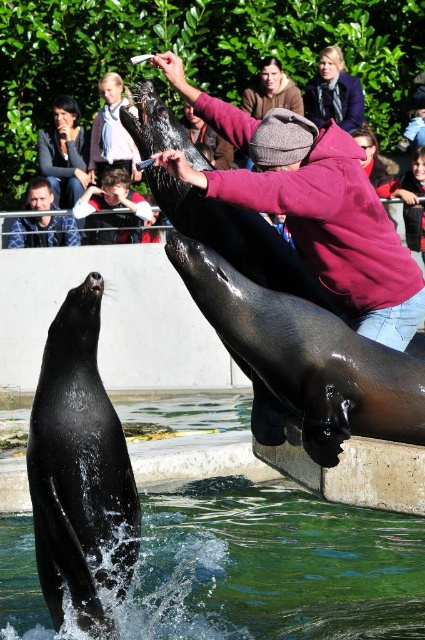
Does shiny black seal at center appear on the right side of light blue scarf at upper center?

Indeed, shiny black seal at center is positioned on the right side of light blue scarf at upper center.

Based on the photo, does shiny black seal at center appear over light blue scarf at upper center?

No.

The height and width of the screenshot is (640, 425). Identify the location of shiny black seal at center. (79, 467).

Find the location of `shiny black seal at center`. shiny black seal at center is located at coordinates (79, 467).

Does point (229, 588) come behind point (59, 168)?

No, (229, 588) is in front of (59, 168).

Does green liquid water at seal front appear over dark brown hair at upper left?

Actually, green liquid water at seal front is below dark brown hair at upper left.

Is point (218, 544) positioned behind point (70, 186)?

That is False.

Find the location of a particular element. Image resolution: width=425 pixels, height=640 pixels. green liquid water at seal front is located at coordinates click(x=272, y=566).

Is the position of dark blue woolen coat at upper center less distant than that of light blue scarf at upper center?

Yes.

Where is `dark blue woolen coat at upper center`? dark blue woolen coat at upper center is located at coordinates (334, 92).